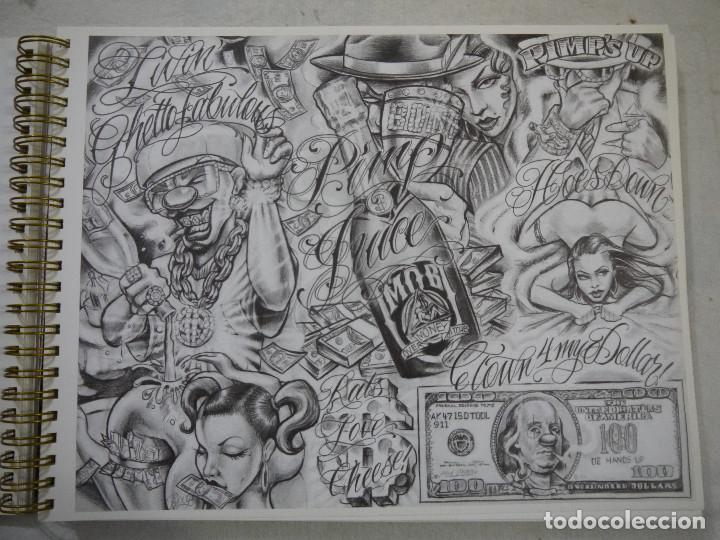
Identify the location of white surface. (710, 259).